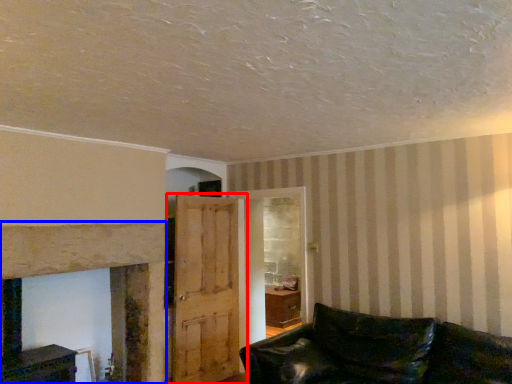
Question: Which of the following is the farthest to the observer, door (highlighted by a red box) or fireplace (highlighted by a blue box)?

Choices:
 (A) door
 (B) fireplace

Answer: (A)